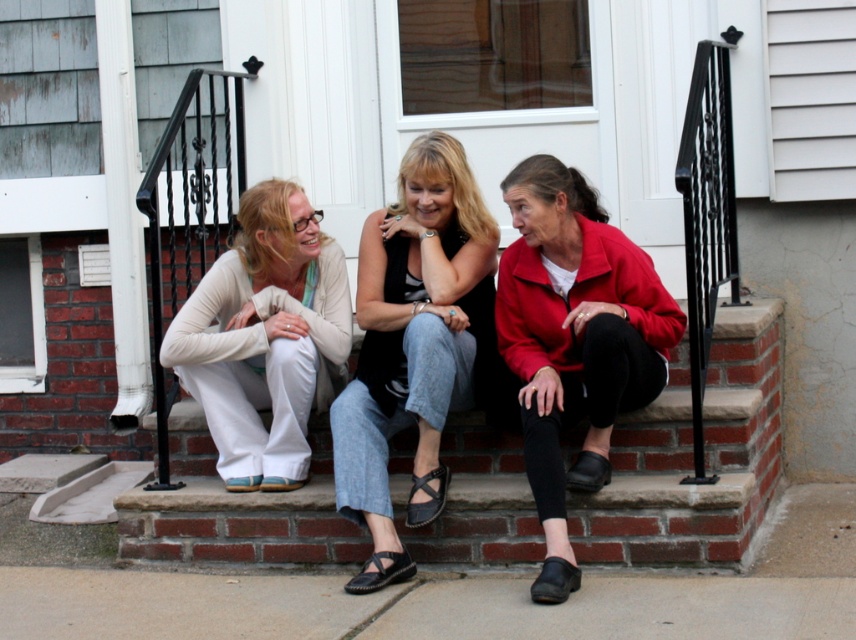
Between smooth brick stairs at center and denim jeans at center, which one appears on the right side from the viewer's perspective?

smooth brick stairs at center

Is point (771, 387) behind point (340, 451)?

Yes.

Identify the location of smooth brick stairs at center. The width and height of the screenshot is (856, 640). (691, 456).

Between denim jeans at center and matte white pants at center, which one appears on the left side from the viewer's perspective?

matte white pants at center is more to the left.

Image resolution: width=856 pixels, height=640 pixels. Describe the element at coordinates (414, 344) in the screenshot. I see `denim jeans at center` at that location.

This screenshot has width=856, height=640. I want to click on denim jeans at center, so click(414, 344).

Between matte red jacket at center and matte white pants at center, which one appears on the right side from the viewer's perspective?

From the viewer's perspective, matte red jacket at center appears more on the right side.

Consider the image. Who is more distant from viewer, (614, 401) or (337, 355)?

Point (337, 355)

This screenshot has width=856, height=640. Find the location of `matte red jacket at center`. matte red jacket at center is located at coordinates (574, 340).